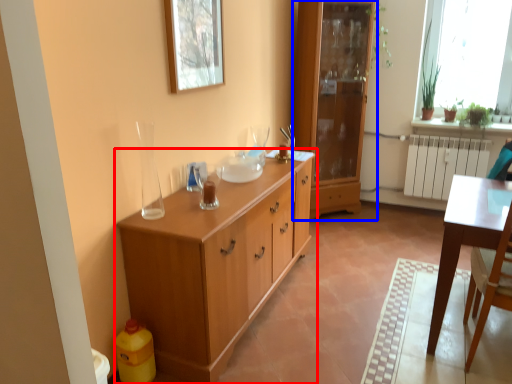
Question: Which object is further to the camera taking this photo, chest of drawers (highlighted by a red box) or cabinetry (highlighted by a blue box)?

Choices:
 (A) chest of drawers
 (B) cabinetry

Answer: (B)